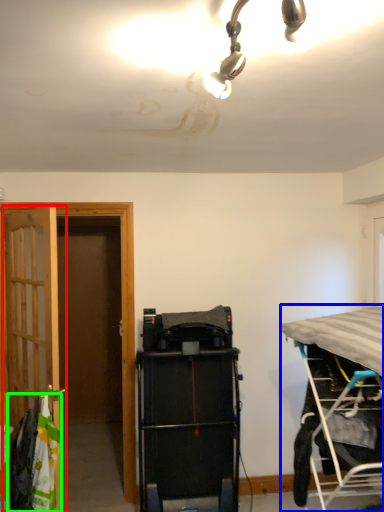
Question: Estimate the real-world distances between objects in this image. Which object is farther from door (highlighted by a red box), bed (highlighted by a blue box) or laundry (highlighted by a green box)?

Choices:
 (A) bed
 (B) laundry

Answer: (A)